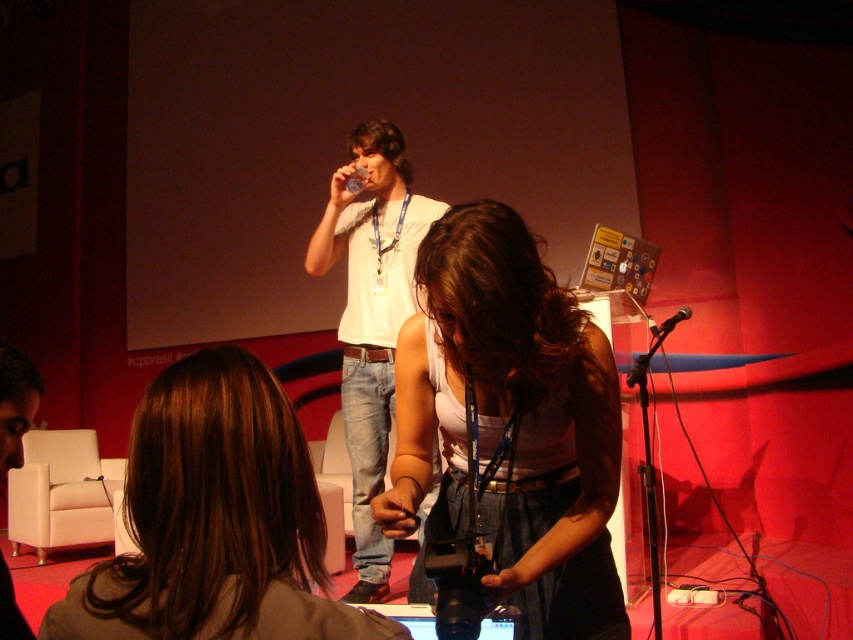
You are a technician setting up equipment for a presentation. You have a black plastic video camera at center and a black plastic microphone at center on the stage. Which object is taller?

The black plastic video camera at center is taller than the black plastic microphone at center.

You are a technician in a conference room setting. You need to determine which of the two items at center is smaller. The items are the black plastic video camera at center and the black plastic microphone at center. Can you identify which one is smaller?

The black plastic video camera at center is smaller than the black plastic microphone at center.